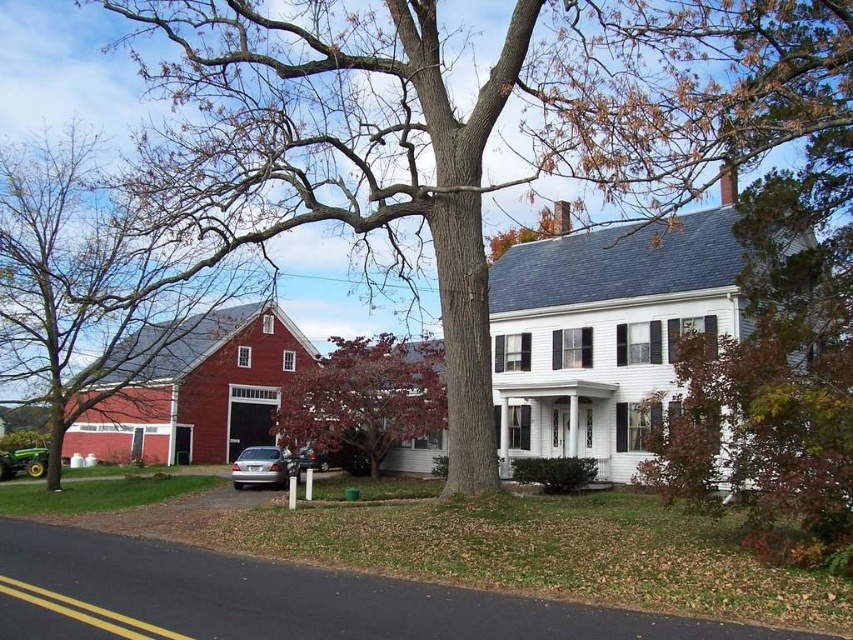
You are a farmer who needs to place a 10 meter long fence between the bare wood tree at center and the smooth red barn at left. Is there enough space to place the fence between them?

The distance between the bare wood tree at center and the smooth red barn at left is 11.10 meters, so yes, there is enough space to place the 10 meter long fence between them.

You are standing at the origin point of the image coordinate system. The image has a coordinate system where the bottom left corner is the origin. You want to locate the bare wood tree at center. What are its coordinates?

The coordinates of the bare wood tree at center are at point (482, 129).